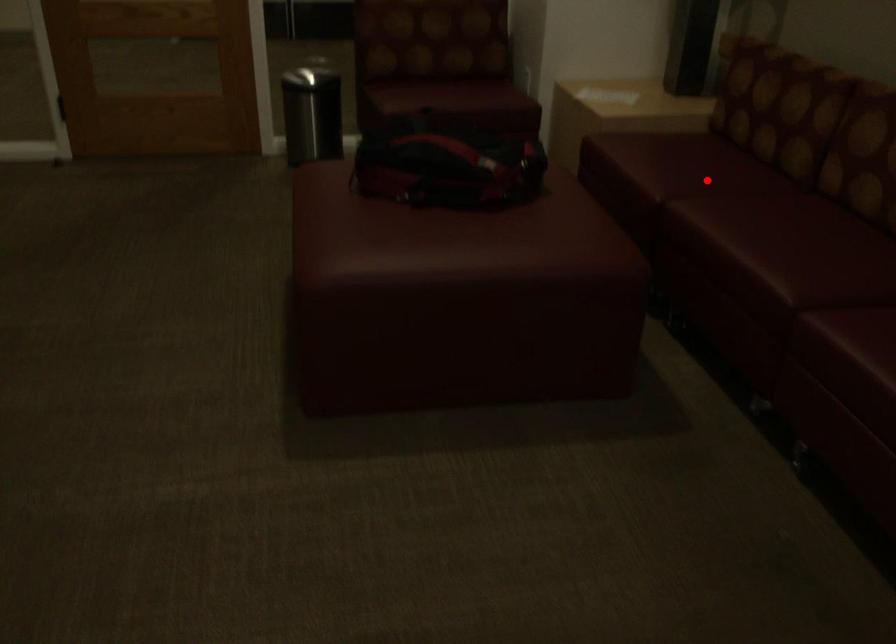
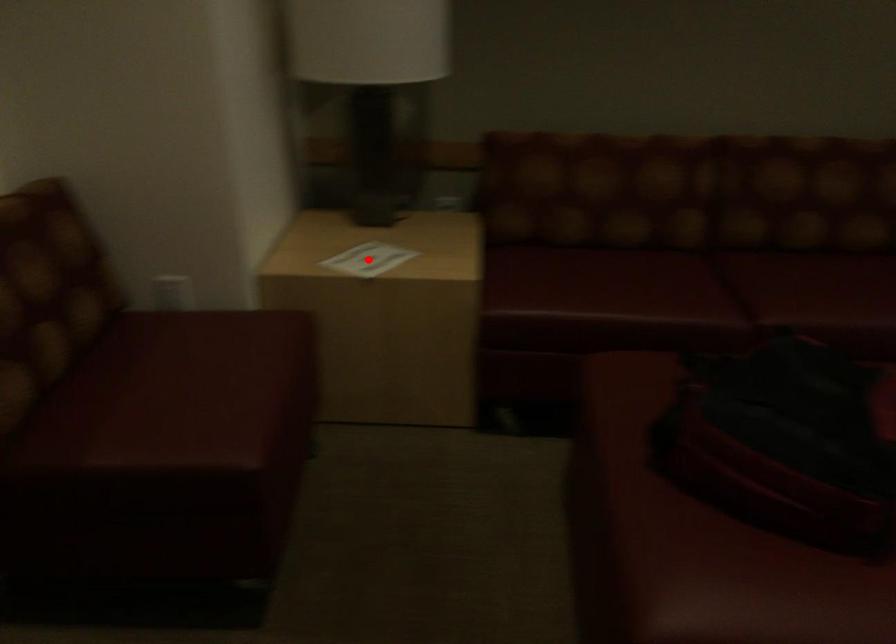
I am providing you with two images of the same scene from different viewpoints. A red point is marked on the first image and another point is marked on the second image. Does the point marked in image1 correspond to the same location as the one in image2?

No